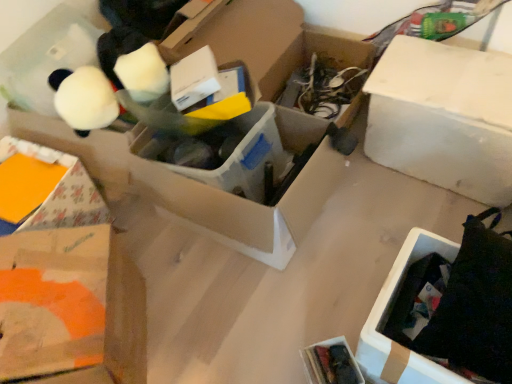
This screenshot has width=512, height=384. I want to click on unoccupied space behind black cardboard box at lower right, so click(x=373, y=250).